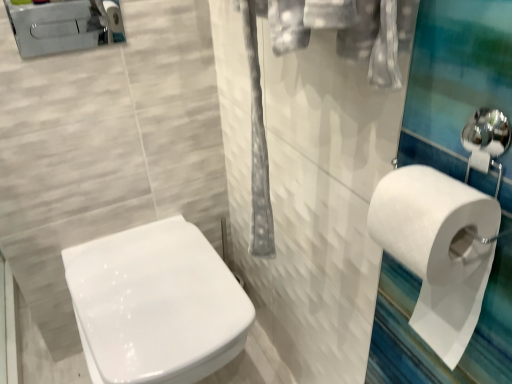
Question: Is brushed metal toilet at upper left closer to camera compared to white matte toilet paper at right?

Choices:
 (A) no
 (B) yes

Answer: (A)

Question: Is brushed metal toilet at upper left facing towards white matte toilet paper at right?

Choices:
 (A) yes
 (B) no

Answer: (A)

Question: Considering the relative positions of brushed metal toilet at upper left and white matte toilet paper at right in the image provided, is brushed metal toilet at upper left to the right of white matte toilet paper at right from the viewer's perspective?

Choices:
 (A) yes
 (B) no

Answer: (B)

Question: Is white matte toilet paper at right inside brushed metal toilet at upper left?

Choices:
 (A) no
 (B) yes

Answer: (A)

Question: Would you say brushed metal toilet at upper left is a long distance from white matte toilet paper at right?

Choices:
 (A) yes
 (B) no

Answer: (B)

Question: Based on their sizes in the image, would you say white matte toilet paper at right is bigger or smaller than brushed metal toilet at upper left?

Choices:
 (A) big
 (B) small

Answer: (A)

Question: Is white matte toilet paper at right situated inside brushed metal toilet at upper left or outside?

Choices:
 (A) outside
 (B) inside

Answer: (A)

Question: From a real-world perspective, is white matte toilet paper at right physically located above or below brushed metal toilet at upper left?

Choices:
 (A) above
 (B) below

Answer: (B)

Question: Is point (446, 205) closer or farther from the camera than point (77, 13)?

Choices:
 (A) farther
 (B) closer

Answer: (B)

Question: Considering the positions of white matte toilet paper at right and white glossy toilet at center in the image, is white matte toilet paper at right wider or thinner than white glossy toilet at center?

Choices:
 (A) wide
 (B) thin

Answer: (B)

Question: From the image's perspective, is white matte toilet paper at right above or below white glossy toilet at center?

Choices:
 (A) below
 (B) above

Answer: (B)

Question: In the image, is white matte toilet paper at right positioned in front of or behind white glossy toilet at center?

Choices:
 (A) behind
 (B) front

Answer: (B)

Question: In terms of size, does white matte toilet paper at right appear bigger or smaller than white glossy toilet at center?

Choices:
 (A) big
 (B) small

Answer: (B)

Question: From the image's perspective, relative to white glossy toilet at center, is brushed metal toilet at upper left above or below?

Choices:
 (A) above
 (B) below

Answer: (A)

Question: Considering their positions, is brushed metal toilet at upper left located in front of or behind white glossy toilet at center?

Choices:
 (A) behind
 (B) front

Answer: (A)